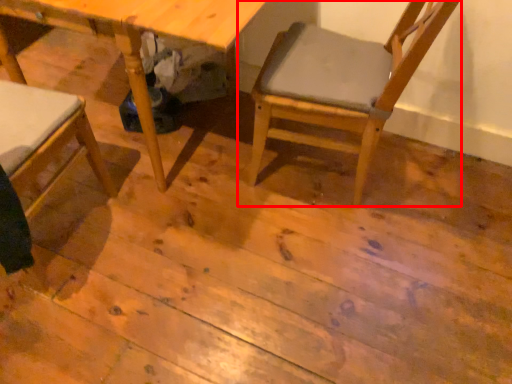
Question: Considering the relative positions of chair (annotated by the red box) and table in the image provided, where is chair (annotated by the red box) located with respect to the staircase?

Choices:
 (A) left
 (B) right

Answer: (B)